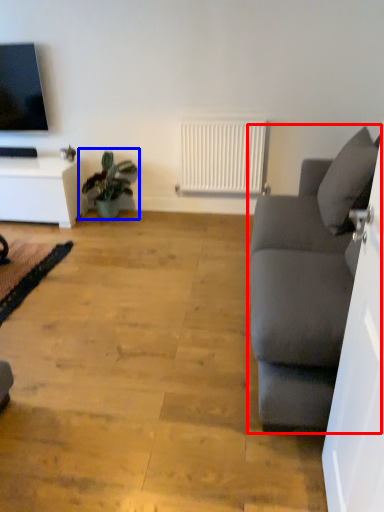
Question: Which of the following is the farthest to the observer, studio couch (highlighted by a red box) or houseplant (highlighted by a blue box)?

Choices:
 (A) studio couch
 (B) houseplant

Answer: (B)